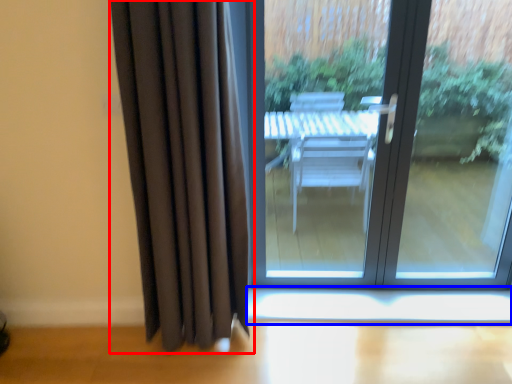
Question: Which point is closer to the camera, curtain (highlighted by a red box) or window sill (highlighted by a blue box)?

Choices:
 (A) curtain
 (B) window sill

Answer: (A)